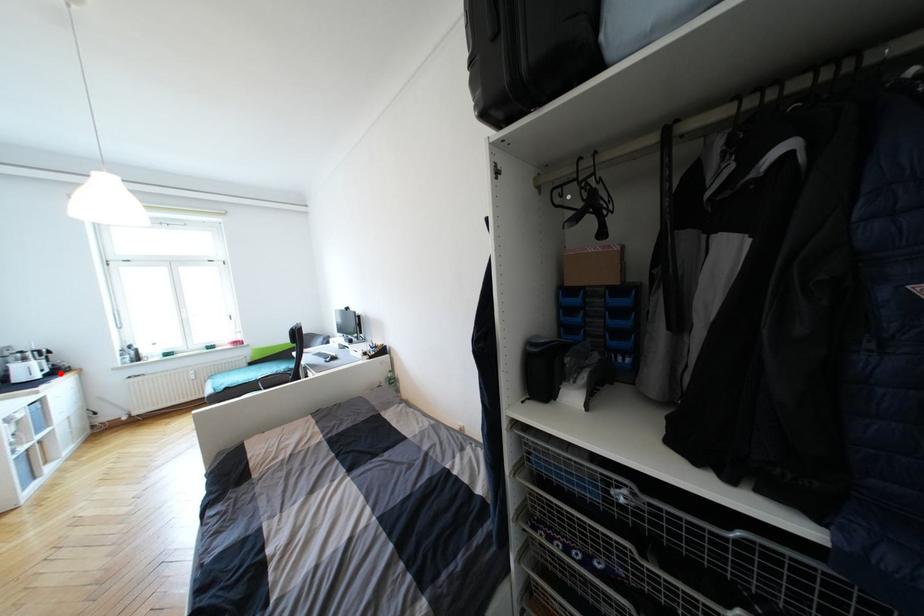
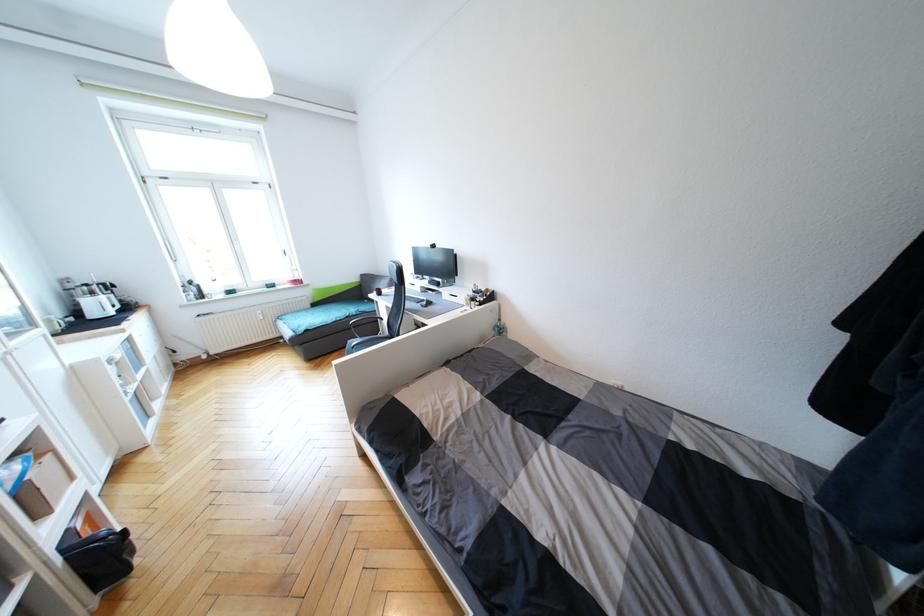
Question: I am providing you with two images of the same scene from different viewpoints. Given a red point in image1, look at the same physical point in image2. Is it:

Choices:
 (A) Closer to the viewpoint
 (B) Farther from the viewpoint

Answer: (A)